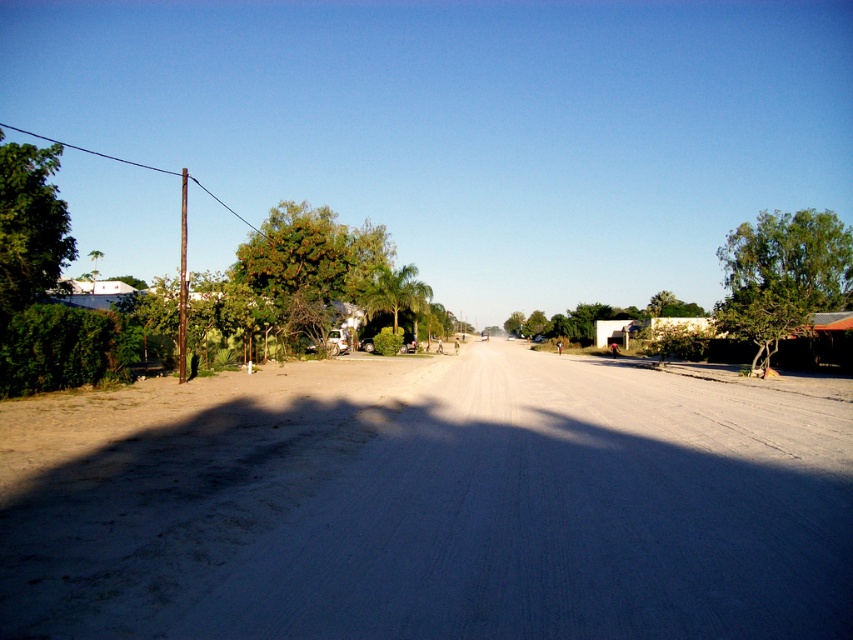
You are standing at the starting point of the road and want to reach the green leafy tree at right. Which direction should you walk along the road to find it?

The green leafy tree at right is located at point 0.431 on the x axis and 0.918 on the y axis, so you should walk along the road towards the right and forward direction to reach it.

You are driving a car and see the gray gravel road at center and the green leafy tree at left. Which object is located to the right of the other?

The gray gravel road at center is positioned on the right side of green leafy tree at left, so the road is to the right of the tree.